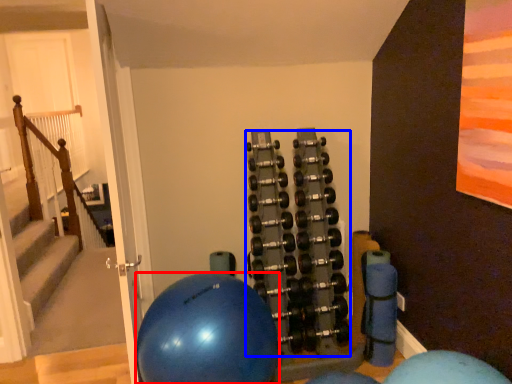
Question: Among these objects, which one is nearest to the camera, ball (highlighted by a red box) or dumbbell (highlighted by a blue box)?

Choices:
 (A) ball
 (B) dumbbell

Answer: (A)